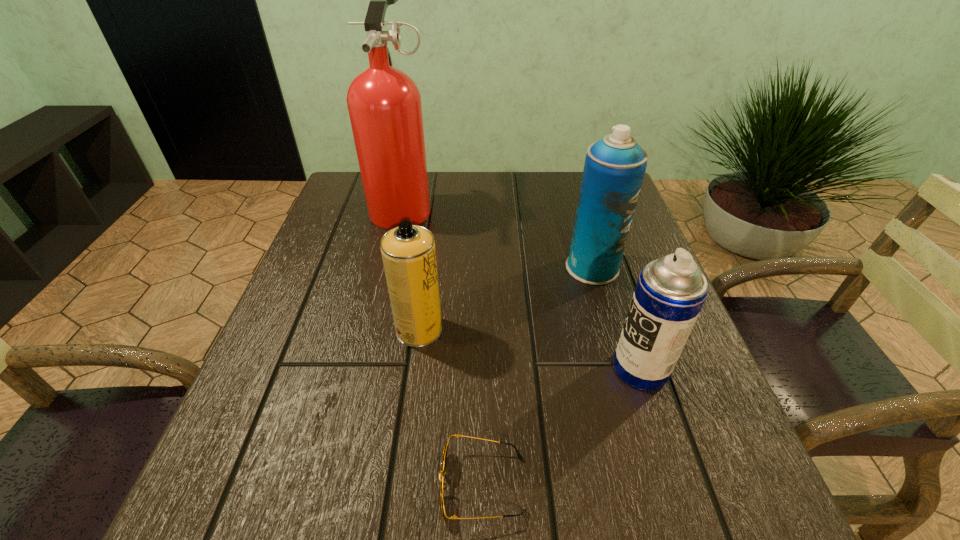
Find the location of `vacant space situated 0.260m on the front-facing side of the nearest object`. vacant space situated 0.260m on the front-facing side of the nearest object is located at coordinates (256, 485).

Locate an element on the screen. The image size is (960, 540). vacant space located on the front-facing side of the nearest object is located at coordinates (384, 485).

Where is `free point located on the front-facing side of the nearest object`? The image size is (960, 540). free point located on the front-facing side of the nearest object is located at coordinates (200, 485).

This screenshot has height=540, width=960. I want to click on object present at the far edge, so click(x=384, y=103).

Locate an element on the screen. The height and width of the screenshot is (540, 960). object located in the near edge section of the desktop is located at coordinates (443, 486).

Where is `object located at the left edge`? object located at the left edge is located at coordinates (384, 103).

At what (x,y) coordinates should I click in order to perform the action: click on object at the far left corner. Please return your answer as a coordinate pair (x, y). This screenshot has width=960, height=540. Looking at the image, I should click on (384, 103).

Find the location of a particular element. The width and height of the screenshot is (960, 540). free spot at the far edge of the desktop is located at coordinates (465, 183).

In the image, there is a desktop. At what (x,y) coordinates should I click in order to perform the action: click on vacant region at the left edge. Please return your answer as a coordinate pair (x, y). The height and width of the screenshot is (540, 960). Looking at the image, I should click on (357, 230).

You are a GUI agent. You are given a task and a screenshot of the screen. Output one action in this format:
    pyautogui.click(x=<x>, y=<y>)
    Task: Click on the blank space at the far left corner of the desktop
    The width and height of the screenshot is (960, 540).
    Given the screenshot: What is the action you would take?
    pyautogui.click(x=363, y=217)